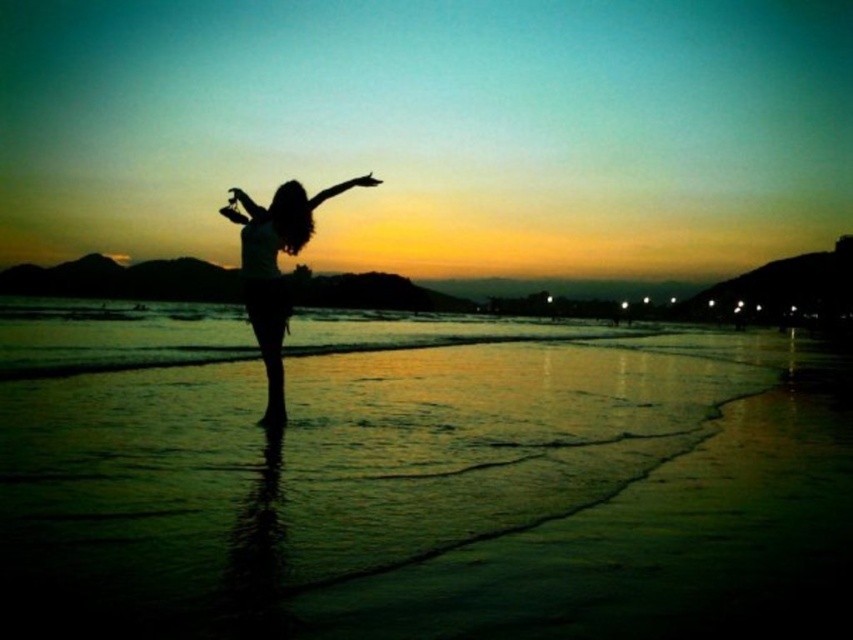
You are standing on the beach and want to take a photo of the silhouette figure at center and the green sand at center. Which object should you focus on first to ensure both are in focus?

Since the green sand at center is closer to the viewer than the silhouette figure at center, you should focus on the green sand at center first to ensure both are in focus.

You are standing on the beach and want to reach the point marked as point (631, 420). If you can walk 2 meters per minute, how long will it take you to reach that point?

The distance between you and point (631, 420) is 10.81 meters. At a walking speed of 2 meters per minute, it would take approximately 5.4 minutes to reach the point.

You are a photographer planning to capture the silhouette figure at center and the green sand at center in a single shot. Based on their positions, which object is closer to the camera?

The silhouette figure at center is closer to the camera since it has a greater height than the green sand at center.